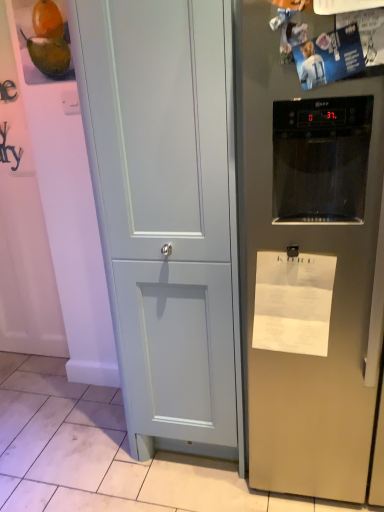
Measure the distance between white paper at right and camera.

white paper at right is 1.15 meters from camera.

Where is `satin silver refrigerator at right`? This screenshot has width=384, height=512. satin silver refrigerator at right is located at coordinates (308, 266).

What do you see at coordinates (308, 266) in the screenshot? I see `satin silver refrigerator at right` at bounding box center [308, 266].

Identify the location of white paper at right. The width and height of the screenshot is (384, 512). (293, 302).

From the image's perspective, would you say white paper at right is positioned over matte light blue cabinet at center?

No, from the image's perspective, white paper at right is not over matte light blue cabinet at center.

Considering the relative positions of white paper at right and matte light blue cabinet at center in the image provided, is white paper at right to the right of matte light blue cabinet at center from the viewer's perspective?

Correct, you'll find white paper at right to the right of matte light blue cabinet at center.

Is matte light blue cabinet at center at the back of white paper at right?

Answer: That's not correct — white paper at right is not looking away from matte light blue cabinet at center.

What's the angular difference between white paper at right and matte light blue cabinet at center's facing directions?

white paper at right and matte light blue cabinet at center are facing 0.0022 degrees away from each other.

Is the position of satin silver refrigerator at right less distant than that of white paper at right?

Yes.

From their relative heights in the image, would you say satin silver refrigerator at right is taller or shorter than white paper at right?

satin silver refrigerator at right is taller than white paper at right.

Is satin silver refrigerator at right positioned beyond the bounds of white paper at right?

Indeed, satin silver refrigerator at right is completely outside white paper at right.

The height and width of the screenshot is (512, 384). I want to click on refrigerator that is above the white paper at right (from the image's perspective), so click(x=308, y=266).

From the image's perspective, would you say white paper at right is shown under satin silver refrigerator at right?

Yes, from the image's perspective, white paper at right is beneath satin silver refrigerator at right.

Which of these two, white paper at right or satin silver refrigerator at right, is smaller?

Smaller between the two is white paper at right.

Is white paper at right looking in the opposite direction of satin silver refrigerator at right?

Correct, white paper at right is looking away from satin silver refrigerator at right.

Are matte light blue cabinet at center and white paper at right located far from each other?

No.

Between matte light blue cabinet at center and white paper at right, which one has more height?

Standing taller between the two is matte light blue cabinet at center.

Could you tell me if matte light blue cabinet at center is turned towards white paper at right?

No.

Is the position of matte light blue cabinet at center more distant than that of white paper at right?

No, the depth of matte light blue cabinet at center is less than that of white paper at right.

Is satin silver refrigerator at right touching matte light blue cabinet at center?

No, satin silver refrigerator at right is not next to matte light blue cabinet at center.

Between satin silver refrigerator at right and matte light blue cabinet at center, which one has more height?

With more height is matte light blue cabinet at center.

Measure the distance between satin silver refrigerator at right and matte light blue cabinet at center.

satin silver refrigerator at right and matte light blue cabinet at center are 24.39 centimeters apart from each other.

The width and height of the screenshot is (384, 512). Find the location of `refrigerator lying on the right of matte light blue cabinet at center`. refrigerator lying on the right of matte light blue cabinet at center is located at coordinates (308, 266).

From the image's perspective, which is above, matte light blue cabinet at center or satin silver refrigerator at right?

matte light blue cabinet at center.

Would you consider matte light blue cabinet at center to be distant from satin silver refrigerator at right?

They are positioned close to each other.

Looking at their sizes, would you say matte light blue cabinet at center is wider or thinner than satin silver refrigerator at right?

matte light blue cabinet at center is thinner than satin silver refrigerator at right.

You are a GUI agent. You are given a task and a screenshot of the screen. Output one action in this format:
    pyautogui.click(x=<x>, y=<y>)
    Task: Click on the paper that appears behind the matte light blue cabinet at center
    
    Given the screenshot: What is the action you would take?
    pyautogui.click(x=293, y=302)

The image size is (384, 512). What are the coordinates of `refrigerator located on the right of white paper at right` in the screenshot? It's located at (308, 266).

Based on their spatial positions, is white paper at right or matte light blue cabinet at center further from satin silver refrigerator at right?

Based on the image, matte light blue cabinet at center appears to be further to satin silver refrigerator at right.

From the image, which object appears to be farther from matte light blue cabinet at center, white paper at right or satin silver refrigerator at right?

Based on the image, white paper at right appears to be further to matte light blue cabinet at center.

Which object lies further to the anchor point white paper at right, satin silver refrigerator at right or matte light blue cabinet at center?

matte light blue cabinet at center.

Considering their positions, is matte light blue cabinet at center positioned further to satin silver refrigerator at right than white paper at right?

matte light blue cabinet at center is positioned further to the anchor satin silver refrigerator at right.

From the image, which object appears to be farther from white paper at right, matte light blue cabinet at center or satin silver refrigerator at right?

Based on the image, matte light blue cabinet at center appears to be further to white paper at right.

From the image, which object appears to be farther from matte light blue cabinet at center, satin silver refrigerator at right or white paper at right?

white paper at right lies further to matte light blue cabinet at center than the other object.

Identify the location of door located between satin silver refrigerator at right and white paper at right in the depth direction. This screenshot has width=384, height=512. (167, 214).